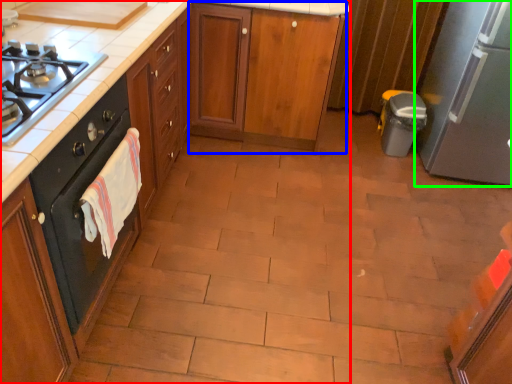
Question: Considering the real-world distances, which object is closest to cabinetry (highlighted by a red box)? cabinetry (highlighted by a blue box) or kitchen appliance (highlighted by a green box).

Choices:
 (A) cabinetry
 (B) kitchen appliance

Answer: (A)